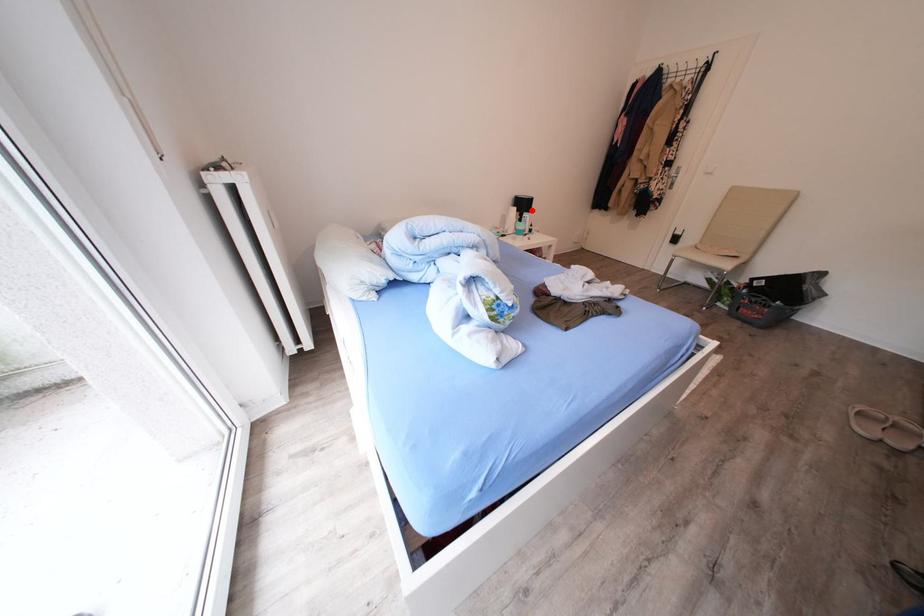
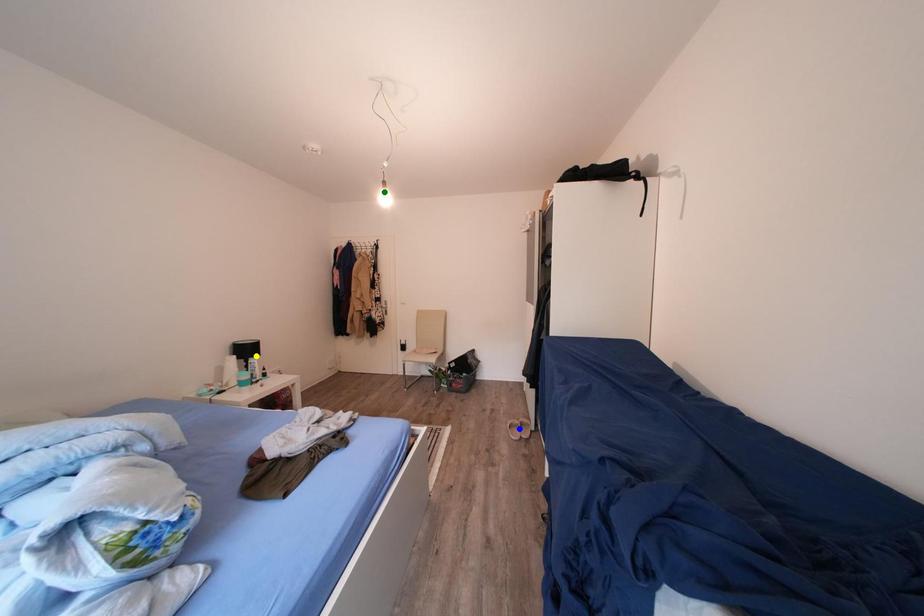
Question: I am providing you with two images of the same scene from different viewpoints. A red point is marked on the first image. You are given multiple points on the second image. In image 2, which mark is for the same physical point as the one in image 1?

Choices:
 (A) yellow point
 (B) green point
 (C) blue point

Answer: (A)